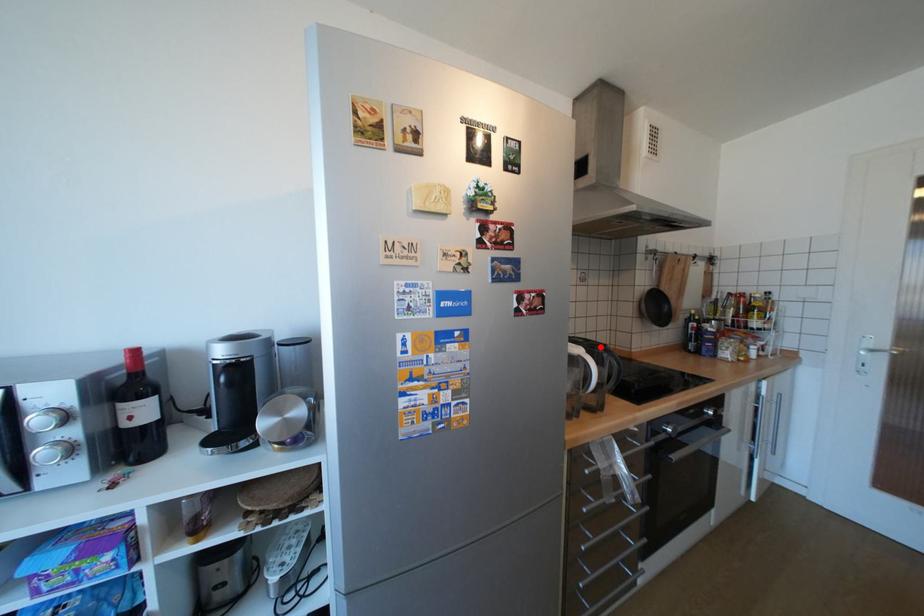
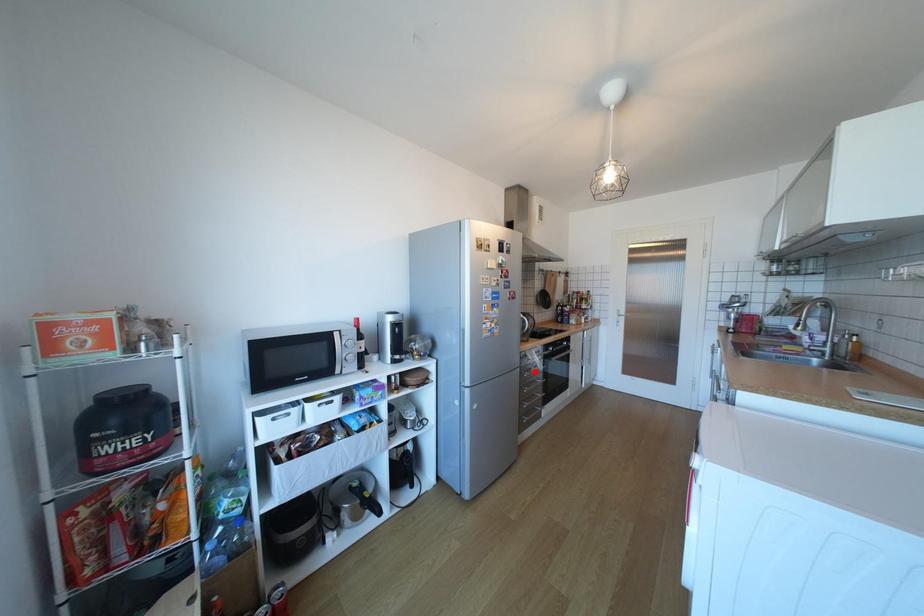
I am providing you with two images of the same scene from different viewpoints. A red point is marked on the first image and another point is marked on the second image. Do the highlighted points in image1 and image2 indicate the same real-world spot?

No